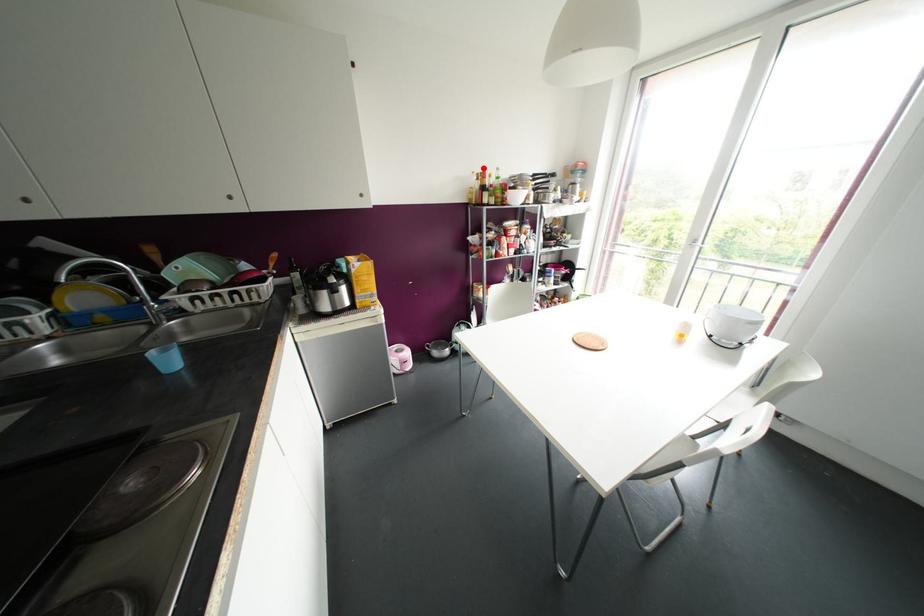
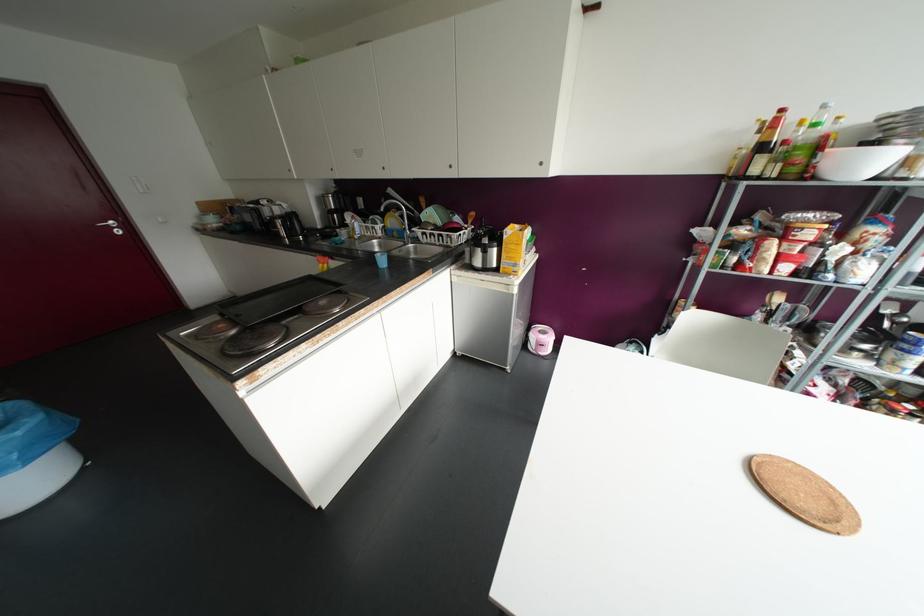
Question: A red point is marked in image1. In image2, is the corresponding 3D point closer to the camera or farther? Reply with the corresponding letter.

Choices:
 (A) The corresponding 3D point is closer.
 (B) The corresponding 3D point is farther.

Answer: (B)